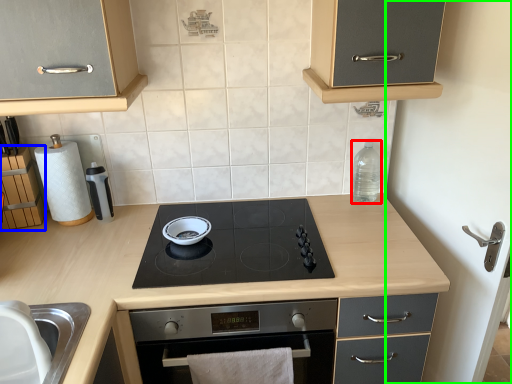
Question: Considering the real-world distances, which object is closest to bottle (highlighted by a red box)? cabinetry (highlighted by a blue box) or side (highlighted by a green box).

Choices:
 (A) cabinetry
 (B) side

Answer: (B)